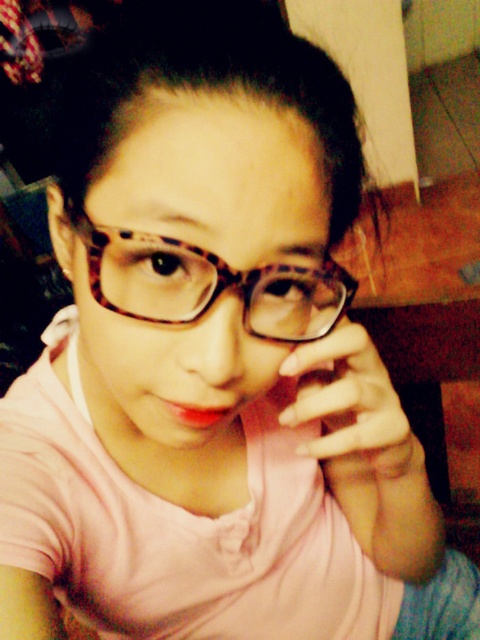
Which is in front, point (115, 250) or point (394, 433)?

Positioned in front is point (115, 250).

Does leopard print glasses at center have a lesser height compared to nail polish at center?

Yes, leopard print glasses at center is shorter than nail polish at center.

I want to click on leopard print glasses at center, so click(x=207, y=284).